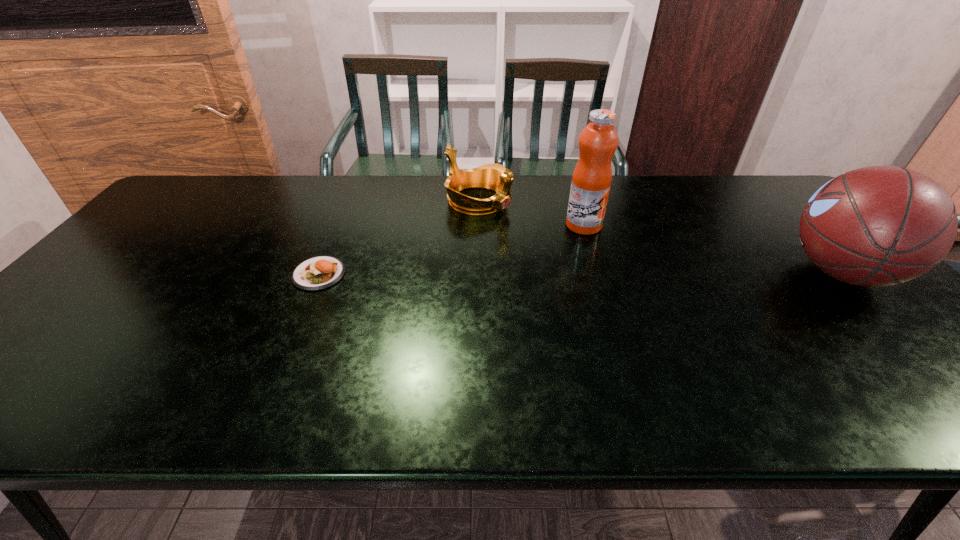
The image size is (960, 540). I want to click on vacant space located on the front label of the third object from left to right, so click(x=632, y=280).

At what (x,y) coordinates should I click in order to perform the action: click on free space located on the front label of the third object from left to right. Please return your answer as a coordinate pair (x, y). Image resolution: width=960 pixels, height=540 pixels. Looking at the image, I should click on (659, 311).

Image resolution: width=960 pixels, height=540 pixels. What are the coordinates of `vacant space located on the front label of the third object from left to right` in the screenshot? It's located at (613, 259).

This screenshot has width=960, height=540. In order to click on free location located at the front emblem of the third object from right to left in this screenshot , I will do point(585,251).

Locate an element on the screen. The height and width of the screenshot is (540, 960). vacant space situated 0.360m at the front emblem of the third object from right to left is located at coordinates pyautogui.click(x=604, y=260).

Find the location of a particular element. The image size is (960, 540). blank space located 0.100m at the front emblem of the third object from right to left is located at coordinates (529, 224).

This screenshot has height=540, width=960. I want to click on object situated at the far edge, so click(496, 177).

At what (x,y) coordinates should I click in order to perform the action: click on object positioned at the right edge. Please return your answer as a coordinate pair (x, y). The height and width of the screenshot is (540, 960). Looking at the image, I should click on (876, 226).

In the image, there is a desktop. Where is `vacant space at the far edge`? The width and height of the screenshot is (960, 540). vacant space at the far edge is located at coordinates [x=408, y=186].

You are a GUI agent. You are given a task and a screenshot of the screen. Output one action in this format:
    pyautogui.click(x=<x>, y=<y>)
    Task: Click on the vacant space at the near edge of the desktop
    
    Given the screenshot: What is the action you would take?
    pyautogui.click(x=804, y=370)